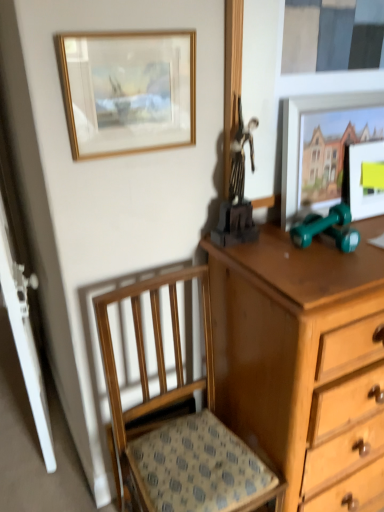
You are a GUI agent. You are given a task and a screenshot of the screen. Output one action in this format:
    pyautogui.click(x=<x>, y=<y>)
    Task: Click on the shiny black statue at upper center, which is counted as the second toy, starting from the right
    
    Given the screenshot: What is the action you would take?
    pyautogui.click(x=237, y=191)

You are a GUI agent. You are given a task and a screenshot of the screen. Output one action in this format:
    pyautogui.click(x=<x>, y=<y>)
    Task: Click on the matte wooden picture frame at upper right, which is the third picture frame in left-to-right order
    
    Given the screenshot: What is the action you would take?
    pyautogui.click(x=364, y=179)

I want to click on shiny black statue at upper center, arranged as the 1th toy when viewed from the left, so click(x=237, y=191).

This screenshot has width=384, height=512. What are the coordinates of `the 2nd toy behind the gold-framed painting at upper left, acting as the first picture frame starting from the left` in the screenshot? It's located at (327, 229).

Looking at this image, which of these two, gold-framed painting at upper left, the 3th picture frame viewed from the right, or green rubber dumbbells at right, the second toy from the left, is wider?

Wider between the two is green rubber dumbbells at right, the second toy from the left.

What's the angular difference between gold-framed painting at upper left, the 3th picture frame viewed from the right, and green rubber dumbbells at right, the second toy from the left,'s facing directions?

gold-framed painting at upper left, the 3th picture frame viewed from the right, and green rubber dumbbells at right, the second toy from the left, are facing 0.75 degrees away from each other.

Does gold-framed painting at upper left, acting as the first picture frame starting from the left, turn towards green rubber dumbbells at right, the second toy from the left?

No, gold-framed painting at upper left, acting as the first picture frame starting from the left, is not oriented towards green rubber dumbbells at right, the second toy from the left.

What's the angular difference between green rubber dumbbells at right, the second toy from the left, and wooden chair at lower left's facing directions?

They differ by 0.0016 degrees in their facing directions.

Is green rubber dumbbells at right, the first toy viewed from the right, turned away from wooden chair at lower left?

green rubber dumbbells at right, the first toy viewed from the right, does not have its back to wooden chair at lower left.

Which is in front, green rubber dumbbells at right, the first toy viewed from the right, or wooden chair at lower left?

wooden chair at lower left.

From the image's perspective, is green rubber dumbbells at right, the first toy viewed from the right, on top of wooden chair at lower left?

Correct, green rubber dumbbells at right, the first toy viewed from the right, appears higher than wooden chair at lower left in the image.

Based on the photo, is green rubber dumbbells at right, the first toy viewed from the right, smaller than matte wooden picture frame at upper right, the second picture frame in the left-to-right sequence?

Yes, green rubber dumbbells at right, the first toy viewed from the right, is smaller than matte wooden picture frame at upper right, the second picture frame in the left-to-right sequence.

From the image's perspective, which one is positioned higher, green rubber dumbbells at right, the first toy viewed from the right, or matte wooden picture frame at upper right, positioned as the 2th picture frame in right-to-left order?

matte wooden picture frame at upper right, positioned as the 2th picture frame in right-to-left order, from the image's perspective.

What's the angular difference between green rubber dumbbells at right, the second toy from the left, and matte wooden picture frame at upper right, the second picture frame in the left-to-right sequence,'s facing directions?

0.749 degrees separate the facing orientations of green rubber dumbbells at right, the second toy from the left, and matte wooden picture frame at upper right, the second picture frame in the left-to-right sequence.

Is green rubber dumbbells at right, the first toy viewed from the right, to the left or to the right of matte wooden picture frame at upper right, positioned as the 2th picture frame in right-to-left order, in the image?

green rubber dumbbells at right, the first toy viewed from the right, is to the left of matte wooden picture frame at upper right, positioned as the 2th picture frame in right-to-left order.

Who is shorter, matte wooden picture frame at upper right, which is the third picture frame in left-to-right order, or matte wooden picture frame at upper right, positioned as the 2th picture frame in right-to-left order?

Standing shorter between the two is matte wooden picture frame at upper right, which is the third picture frame in left-to-right order.

Is matte wooden picture frame at upper right, the 1th picture frame when ordered from right to left, smaller than matte wooden picture frame at upper right, the second picture frame in the left-to-right sequence?

Yes, matte wooden picture frame at upper right, the 1th picture frame when ordered from right to left, is smaller than matte wooden picture frame at upper right, the second picture frame in the left-to-right sequence.

Choose the correct answer: Is matte wooden picture frame at upper right, the 1th picture frame when ordered from right to left, inside matte wooden picture frame at upper right, the second picture frame in the left-to-right sequence, or outside it?

matte wooden picture frame at upper right, the 1th picture frame when ordered from right to left, exists entirely within matte wooden picture frame at upper right, the second picture frame in the left-to-right sequence.

The height and width of the screenshot is (512, 384). In order to click on picture frame that is the 1st one when counting leftward from the matte wooden picture frame at upper right, the 1th picture frame when ordered from right to left in this screenshot , I will do `click(299, 135)`.

Would you say gold-framed painting at upper left, the 3th picture frame viewed from the right, is a long distance from shiny black statue at upper center, arranged as the 1th toy when viewed from the left?

No.

Is gold-framed painting at upper left, the 3th picture frame viewed from the right, aimed at shiny black statue at upper center, which is counted as the second toy, starting from the right?

No, gold-framed painting at upper left, the 3th picture frame viewed from the right, is not oriented towards shiny black statue at upper center, which is counted as the second toy, starting from the right.

Does gold-framed painting at upper left, the 3th picture frame viewed from the right, have a lesser width compared to shiny black statue at upper center, arranged as the 1th toy when viewed from the left?

Correct, the width of gold-framed painting at upper left, the 3th picture frame viewed from the right, is less than that of shiny black statue at upper center, arranged as the 1th toy when viewed from the left.

Which is more to the left, matte wooden picture frame at upper right, which is the third picture frame in left-to-right order, or green rubber dumbbells at right, the first toy viewed from the right?

Positioned to the left is green rubber dumbbells at right, the first toy viewed from the right.

Is matte wooden picture frame at upper right, which is the third picture frame in left-to-right order, bigger than green rubber dumbbells at right, the second toy from the left?

Yes.

Is matte wooden picture frame at upper right, the 1th picture frame when ordered from right to left, placed right next to green rubber dumbbells at right, the second toy from the left?

No, matte wooden picture frame at upper right, the 1th picture frame when ordered from right to left, is not making contact with green rubber dumbbells at right, the second toy from the left.

Which is correct: matte wooden picture frame at upper right, the second picture frame in the left-to-right sequence, is inside wooden chair at lower left, or outside of it?

matte wooden picture frame at upper right, the second picture frame in the left-to-right sequence, is located beyond the bounds of wooden chair at lower left.

Is matte wooden picture frame at upper right, the second picture frame in the left-to-right sequence, far away from wooden chair at lower left?

No, matte wooden picture frame at upper right, the second picture frame in the left-to-right sequence, is not far away from wooden chair at lower left.

Is matte wooden picture frame at upper right, the second picture frame in the left-to-right sequence, bigger than wooden chair at lower left?

No, matte wooden picture frame at upper right, the second picture frame in the left-to-right sequence, is not bigger than wooden chair at lower left.

Does matte wooden picture frame at upper right, positioned as the 2th picture frame in right-to-left order, have a lesser width compared to wooden chair at lower left?

Yes, matte wooden picture frame at upper right, positioned as the 2th picture frame in right-to-left order, is thinner than wooden chair at lower left.

Identify the location of toy that is the 2nd one when counting backward from the gold-framed painting at upper left, the 3th picture frame viewed from the right. The image size is (384, 512). [327, 229].

Find the location of a particular element. chair below the green rubber dumbbells at right, the second toy from the left (from the image's perspective) is located at coordinates (177, 423).

Which object lies nearer to the anchor point gold-framed painting at upper left, the 3th picture frame viewed from the right, shiny black statue at upper center, which is counted as the second toy, starting from the right, or matte wooden picture frame at upper right, the second picture frame in the left-to-right sequence?

shiny black statue at upper center, which is counted as the second toy, starting from the right, lies closer to gold-framed painting at upper left, the 3th picture frame viewed from the right, than the other object.

From the image, which object appears to be farther from gold-framed painting at upper left, the 3th picture frame viewed from the right, shiny black statue at upper center, arranged as the 1th toy when viewed from the left, or wooden chair at lower left?

wooden chair at lower left is further to gold-framed painting at upper left, the 3th picture frame viewed from the right.

When comparing their distances from green rubber dumbbells at right, the first toy viewed from the right, does shiny black statue at upper center, arranged as the 1th toy when viewed from the left, or matte wooden picture frame at upper right, the second picture frame in the left-to-right sequence, seem closer?

The object closer to green rubber dumbbells at right, the first toy viewed from the right, is matte wooden picture frame at upper right, the second picture frame in the left-to-right sequence.

When comparing their distances from matte wooden picture frame at upper right, the second picture frame in the left-to-right sequence, does wooden chair at lower left or green rubber dumbbells at right, the second toy from the left, seem further?

wooden chair at lower left.

Considering their positions, is matte wooden picture frame at upper right, the second picture frame in the left-to-right sequence, positioned closer to wooden chair at lower left than green rubber dumbbells at right, the first toy viewed from the right?

Based on the image, green rubber dumbbells at right, the first toy viewed from the right, appears to be nearer to wooden chair at lower left.

Considering their positions, is shiny black statue at upper center, which is counted as the second toy, starting from the right, positioned closer to matte wooden picture frame at upper right, positioned as the 2th picture frame in right-to-left order, than matte wooden picture frame at upper right, which is the third picture frame in left-to-right order?

shiny black statue at upper center, which is counted as the second toy, starting from the right, is closer to matte wooden picture frame at upper right, positioned as the 2th picture frame in right-to-left order.

Estimate the real-world distances between objects in this image. Which object is closer to wooden chair at lower left, matte wooden picture frame at upper right, the 1th picture frame when ordered from right to left, or gold-framed painting at upper left, acting as the first picture frame starting from the left?

Among the two, gold-framed painting at upper left, acting as the first picture frame starting from the left, is located nearer to wooden chair at lower left.

In the scene shown: From the image, which object appears to be farther from matte wooden picture frame at upper right, the 1th picture frame when ordered from right to left, wooden chair at lower left or green rubber dumbbells at right, the second toy from the left?

wooden chair at lower left lies further to matte wooden picture frame at upper right, the 1th picture frame when ordered from right to left, than the other object.

Locate an element on the screen. Image resolution: width=384 pixels, height=512 pixels. picture frame located between shiny black statue at upper center, which is counted as the second toy, starting from the right, and matte wooden picture frame at upper right, which is the third picture frame in left-to-right order, in the left-right direction is located at coordinates (299, 135).

The image size is (384, 512). Identify the location of toy between shiny black statue at upper center, which is counted as the second toy, starting from the right, and wooden chair at lower left vertically. (327, 229).

Identify the location of toy located between gold-framed painting at upper left, the 3th picture frame viewed from the right, and green rubber dumbbells at right, the second toy from the left, in the left-right direction. (237, 191).

In order to click on picture frame between gold-framed painting at upper left, the 3th picture frame viewed from the right, and matte wooden picture frame at upper right, which is the third picture frame in left-to-right order in this screenshot , I will do `click(299, 135)`.